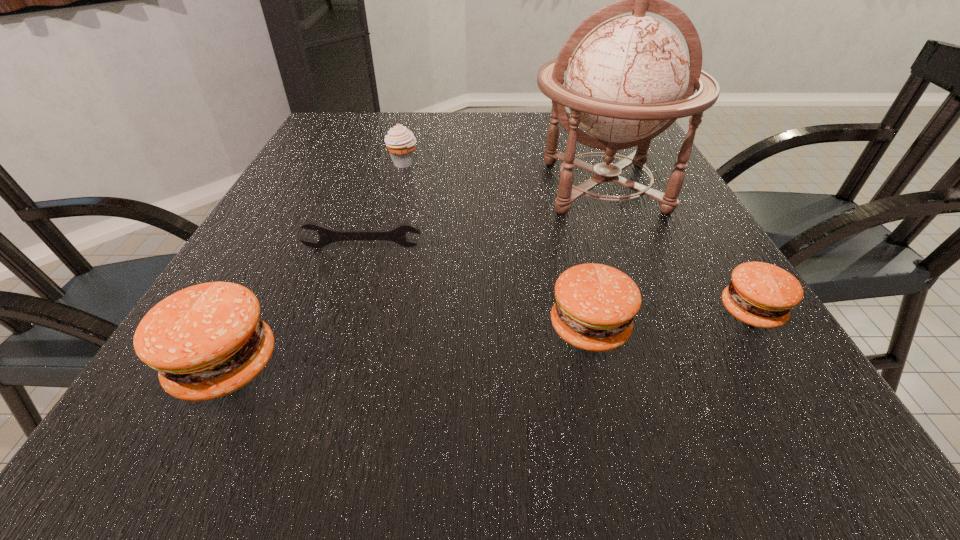
This screenshot has width=960, height=540. In the image, there is a desktop. Identify the location of vacant space at the far edge. (561, 131).

This screenshot has width=960, height=540. I want to click on vacant space at the left edge of the desktop, so click(x=329, y=151).

Where is `vacant space at the right edge of the desktop`? This screenshot has width=960, height=540. vacant space at the right edge of the desktop is located at coordinates (650, 167).

I want to click on vacant region at the far left corner of the desktop, so tap(349, 143).

The height and width of the screenshot is (540, 960). What are the coordinates of `free space at the near left corner of the desktop` in the screenshot? It's located at (276, 345).

In the image, there is a desktop. Where is `vacant space at the near right corner`? vacant space at the near right corner is located at coordinates (685, 348).

This screenshot has height=540, width=960. In order to click on vacant area that lies between the shortest object and the muffin in this screenshot , I will do (383, 205).

In order to click on vacant area between the fourth nearest object and the rightmost patty in this screenshot , I will do `click(557, 279)`.

You are a GUI agent. You are given a task and a screenshot of the screen. Output one action in this format:
    pyautogui.click(x=<x>, y=<y>)
    Task: Click on the vacant point located between the second patty from left to right and the tallest patty
    
    Given the screenshot: What is the action you would take?
    pyautogui.click(x=407, y=347)

The width and height of the screenshot is (960, 540). What are the coordinates of `free space that is in between the tallest patty and the muffin` in the screenshot? It's located at (314, 265).